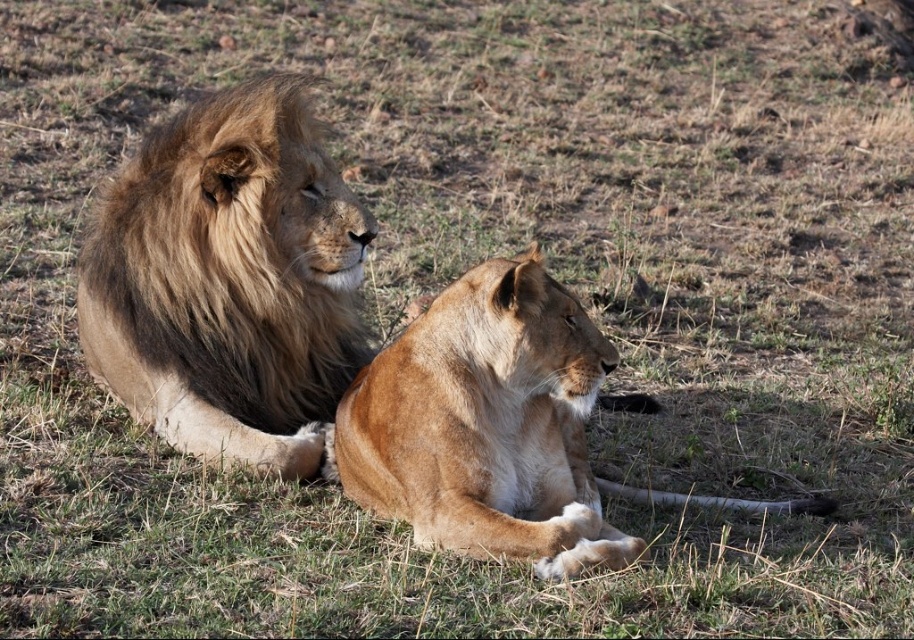
Question: Can you confirm if golden fur lion at upper left is positioned to the left of golden fur lion at center?

Choices:
 (A) no
 (B) yes

Answer: (B)

Question: Observing the image, what is the correct spatial positioning of golden fur lion at upper left in reference to golden fur lion at center?

Choices:
 (A) left
 (B) right

Answer: (A)

Question: Is golden fur lion at upper left to the right of golden fur lion at center from the viewer's perspective?

Choices:
 (A) no
 (B) yes

Answer: (A)

Question: Which point is closer to the camera taking this photo?

Choices:
 (A) (481, 448)
 (B) (291, 96)

Answer: (A)